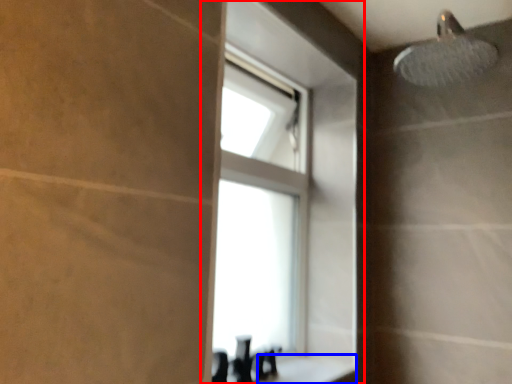
Question: Which point is closer to the camera, window (highlighted by a red box) or counter top (highlighted by a blue box)?

Choices:
 (A) window
 (B) counter top

Answer: (B)